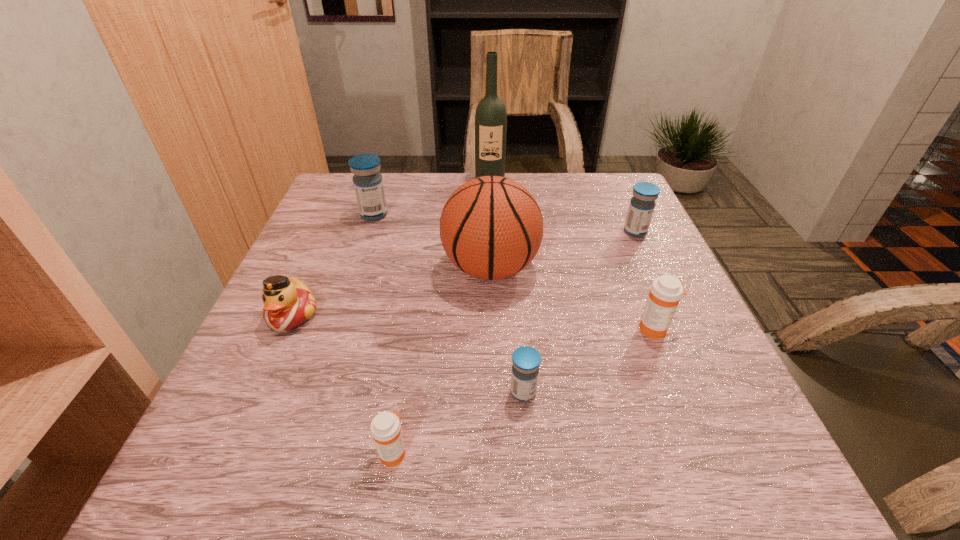
This screenshot has width=960, height=540. Find the location of `the tallest object`. the tallest object is located at coordinates (490, 117).

Where is `wine bottle`? The width and height of the screenshot is (960, 540). wine bottle is located at coordinates (490, 117).

The image size is (960, 540). In order to click on the second tallest object in this screenshot , I will do `click(491, 227)`.

The image size is (960, 540). Find the location of `basketball`. basketball is located at coordinates (491, 227).

Locate an element on the screen. the biggest blue medicine is located at coordinates (368, 184).

I want to click on the second object from left to right, so click(x=368, y=184).

Where is `the right orange medicine`? the right orange medicine is located at coordinates (666, 291).

At what (x,y) coordinates should I click in order to perform the action: click on the third nearest medicine. Please return your answer as a coordinate pair (x, y). This screenshot has height=540, width=960. Looking at the image, I should click on (666, 291).

Where is `the second nearest blue medicine`? This screenshot has width=960, height=540. the second nearest blue medicine is located at coordinates (642, 204).

Locate an element on the screen. The image size is (960, 540). the rightmost blue medicine is located at coordinates (642, 204).